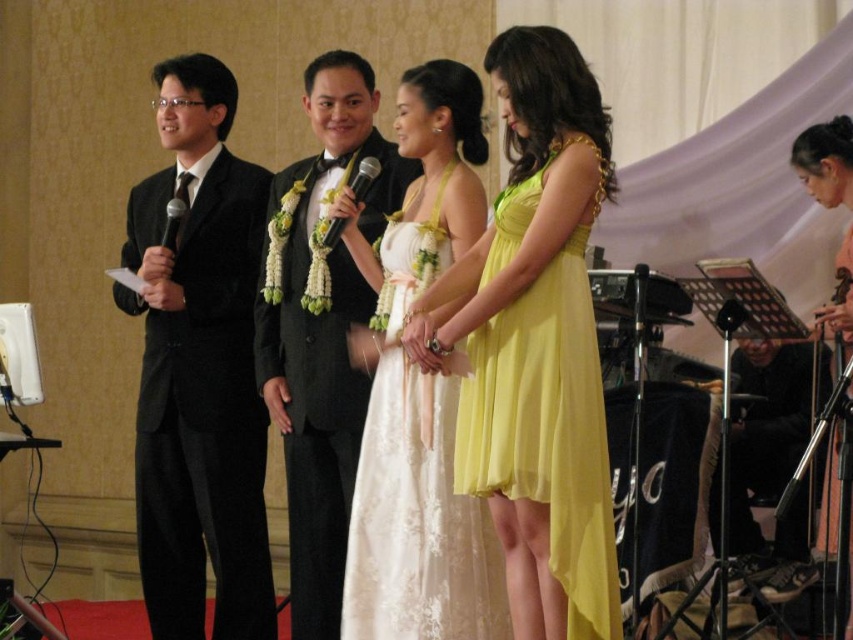
You are planning to place a decorative stand that requires knowing the width of the yellow chiffon dress at center and the black metallic microphone at left. Based on the scene, can you determine which one is wider?

The yellow chiffon dress at center might be wider than black metallic microphone at left according to the description.

You are a photographer at the event and need to frame a shot that includes both the black velvet suit at left and the pink satin dress at lower right. Which of the two requires more horizontal space in the frame?

The black velvet suit at left requires more horizontal space in the frame because its width surpasses that of the pink satin dress at lower right.

You are a photographer positioned at the back of the banquet hall. You need to capture a photo that includes both the black velvet suit at left and the pink satin dress at lower right. Given their distance, can you frame both in a single shot without moving your position?

The black velvet suit at left and the pink satin dress at lower right are 8.43 feet apart. Since this distance is manageable within a standard camera frame, you can capture both in a single shot without moving your position.